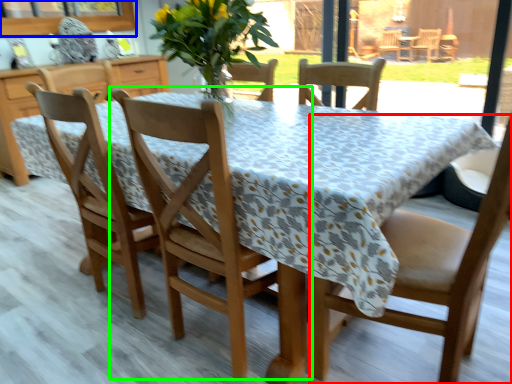
Question: Which is farther away from chair (highlighted by a red box)? window screen (highlighted by a blue box) or chair (highlighted by a green box)?

Choices:
 (A) window screen
 (B) chair

Answer: (A)